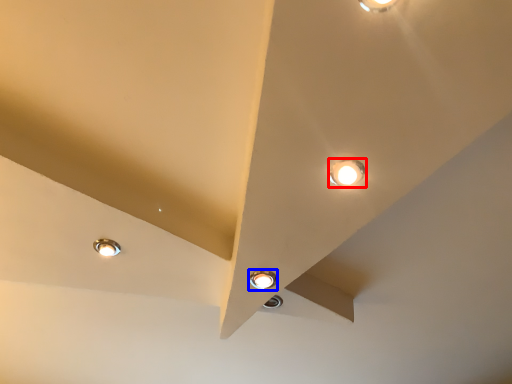
Question: Among these objects, which one is nearest to the camera, lamp (highlighted by a red box) or lamp (highlighted by a blue box)?

Choices:
 (A) lamp
 (B) lamp

Answer: (A)